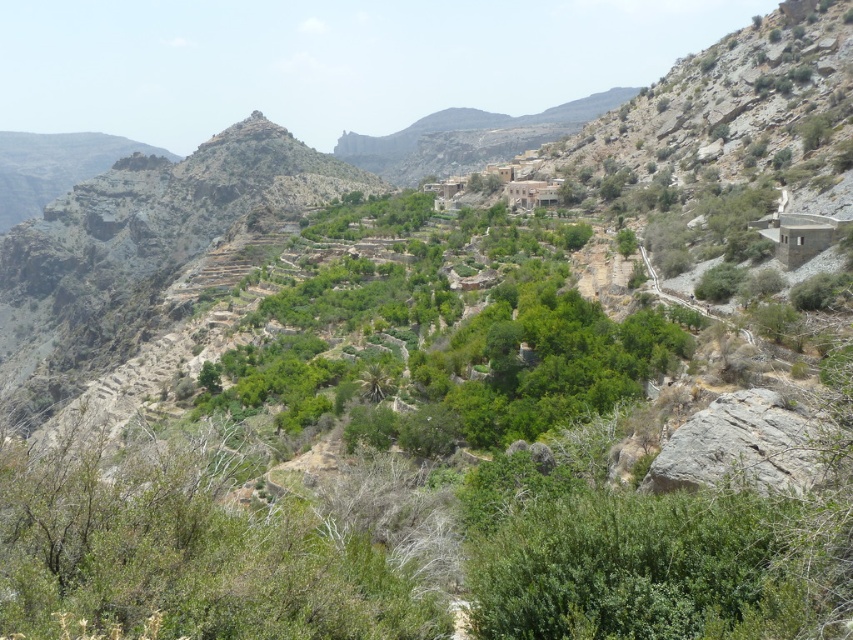
Question: Is green leafy shrubs at center to the left of brown stone village at upper center from the viewer's perspective?

Choices:
 (A) yes
 (B) no

Answer: (A)

Question: Is green leafy shrubs at center positioned behind brown stone village at upper center?

Choices:
 (A) yes
 (B) no

Answer: (B)

Question: Is green leafy shrubs at center wider than brown stone village at upper center?

Choices:
 (A) yes
 (B) no

Answer: (A)

Question: Which of the following is the closest to the observer?

Choices:
 (A) (325, 320)
 (B) (549, 182)

Answer: (A)